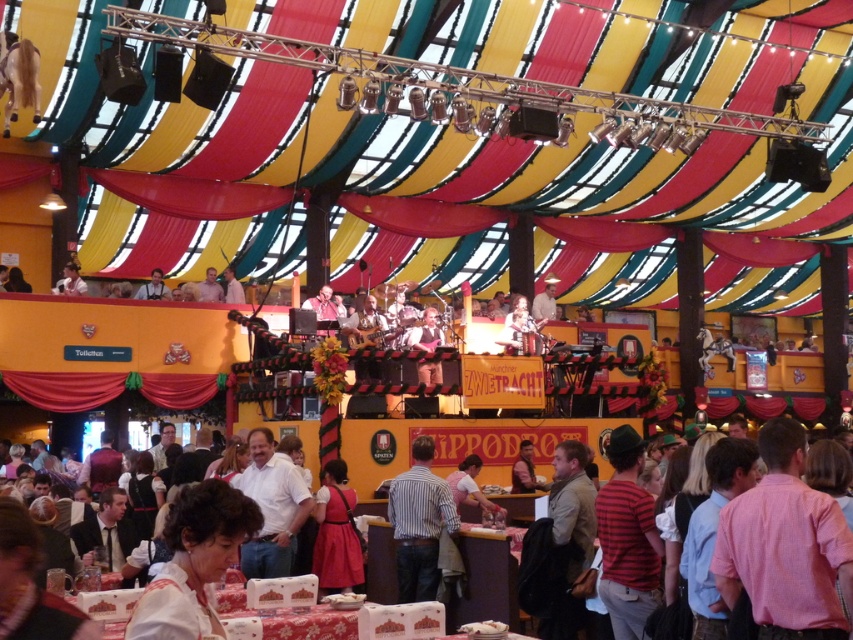
You are an event planner looking at the stage setup for the festival. You notice the matte black shirt at upper center and the white fabric at upper center. Which object is taller? Please answer based on the description provided.

The white fabric at upper center is taller than the matte black shirt at upper center according to the description.